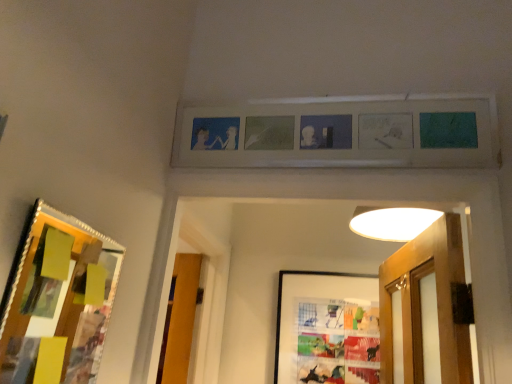
What do you see at coordinates (327, 328) in the screenshot? I see `matte plastic picture frame at center, which ranks as the 1th picture frame in bottom-to-top order` at bounding box center [327, 328].

In order to face wooden-framed collage at left, the 3th picture frame when ordered from back to front, should I rotate leftwards or rightwards?

Rotate your view left by about 23.697°.

Where is `matte plastic picture frame at center, the 1th picture frame when ordered from back to front`? matte plastic picture frame at center, the 1th picture frame when ordered from back to front is located at coordinates (327, 328).

Which is correct: wooden-framed collage at left, the first picture frame when ordered from front to back, is inside matte plastic picture frame at center, the 1th picture frame when ordered from back to front, or outside of it?

wooden-framed collage at left, the first picture frame when ordered from front to back, is not enclosed by matte plastic picture frame at center, the 1th picture frame when ordered from back to front.

What's the angular difference between wooden-framed collage at left, the 3th picture frame when ordered from back to front, and matte plastic picture frame at center, which ranks as the 1th picture frame in bottom-to-top order,'s facing directions?

There is a 88.4-degree angle between the facing directions of wooden-framed collage at left, the 3th picture frame when ordered from back to front, and matte plastic picture frame at center, which ranks as the 1th picture frame in bottom-to-top order.

How distant is wooden-framed collage at left, the first picture frame when ordered from front to back, from matte plastic picture frame at center, the 1th picture frame when ordered from back to front?

wooden-framed collage at left, the first picture frame when ordered from front to back, is 1.14 meters from matte plastic picture frame at center, the 1th picture frame when ordered from back to front.

Does point (98, 351) come farther from viewer compared to point (282, 299)?

No, it is not.

How different are the orientations of wooden-framed collage at left, the 3th picture frame when ordered from back to front, and matte wooden picture frame at upper center, which is counted as the third picture frame, starting from the bottom, in degrees?

89.3 degrees separate the facing orientations of wooden-framed collage at left, the 3th picture frame when ordered from back to front, and matte wooden picture frame at upper center, which is counted as the third picture frame, starting from the bottom.

How much distance is there between wooden-framed collage at left, which is the 2th picture frame from top to bottom, and matte wooden picture frame at upper center, the second picture frame when ordered from front to back?

The distance of wooden-framed collage at left, which is the 2th picture frame from top to bottom, from matte wooden picture frame at upper center, the second picture frame when ordered from front to back, is 26.27 inches.

Is wooden-framed collage at left, the 3th picture frame when ordered from back to front, shorter than matte wooden picture frame at upper center, the first picture frame in the top-to-bottom sequence?

Incorrect, the height of wooden-framed collage at left, the 3th picture frame when ordered from back to front, does not fall short of that of matte wooden picture frame at upper center, the first picture frame in the top-to-bottom sequence.

Is wooden-framed collage at left, which is the 2th picture frame from top to bottom, inside the boundaries of matte wooden picture frame at upper center, which is counted as the third picture frame, starting from the bottom, or outside?

wooden-framed collage at left, which is the 2th picture frame from top to bottom, is outside matte wooden picture frame at upper center, which is counted as the third picture frame, starting from the bottom.

The height and width of the screenshot is (384, 512). I want to click on the 1st picture frame in front of the matte plastic picture frame at center, which is the third picture frame from front to back, counting from the anchor's position, so click(339, 135).

Between matte plastic picture frame at center, which ranks as the 1th picture frame in bottom-to-top order, and matte wooden picture frame at upper center, which is counted as the third picture frame, starting from the bottom, which one has larger size?

With larger size is matte wooden picture frame at upper center, which is counted as the third picture frame, starting from the bottom.

Considering the sizes of matte plastic picture frame at center, which is the third picture frame from front to back, and matte wooden picture frame at upper center, which ranks as the 2th picture frame in back-to-front order, in the image, is matte plastic picture frame at center, which is the third picture frame from front to back, taller or shorter than matte wooden picture frame at upper center, which ranks as the 2th picture frame in back-to-front order,?

Considering their sizes, matte plastic picture frame at center, which is the third picture frame from front to back, has more height than matte wooden picture frame at upper center, which ranks as the 2th picture frame in back-to-front order.

Does matte plastic picture frame at center, which is the third picture frame from front to back, have a lesser width compared to matte wooden picture frame at upper center, which ranks as the 2th picture frame in back-to-front order?

Indeed, matte plastic picture frame at center, which is the third picture frame from front to back, has a lesser width compared to matte wooden picture frame at upper center, which ranks as the 2th picture frame in back-to-front order.

Identify the location of picture frame above the wooden-framed collage at left, the first picture frame when ordered from front to back (from the image's perspective). This screenshot has height=384, width=512. (339, 135).

Looking at their sizes, would you say matte wooden picture frame at upper center, the second picture frame when ordered from front to back, is wider or thinner than wooden-framed collage at left, which is the 2th picture frame from top to bottom?

Clearly, matte wooden picture frame at upper center, the second picture frame when ordered from front to back, has more width compared to wooden-framed collage at left, which is the 2th picture frame from top to bottom.

Is matte wooden picture frame at upper center, the second picture frame when ordered from front to back, not close to wooden-framed collage at left, which is the 2th picture frame from top to bottom?

No, matte wooden picture frame at upper center, the second picture frame when ordered from front to back, is in close proximity to wooden-framed collage at left, which is the 2th picture frame from top to bottom.

Is point (208, 157) farther from viewer compared to point (61, 328)?

No.

Which object is further away from the camera taking this photo, matte plastic picture frame at center, the 1th picture frame when ordered from back to front, or wooden-framed collage at left, the first picture frame when ordered from front to back?

matte plastic picture frame at center, the 1th picture frame when ordered from back to front, is more distant.

Looking at this image, is matte plastic picture frame at center, the 3th picture frame positioned from the top, taller or shorter than wooden-framed collage at left, the 3th picture frame when ordered from back to front?

In the image, matte plastic picture frame at center, the 3th picture frame positioned from the top, appears to be taller than wooden-framed collage at left, the 3th picture frame when ordered from back to front.

Is matte plastic picture frame at center, the 3th picture frame positioned from the top, aimed at wooden-framed collage at left, the 3th picture frame when ordered from back to front?

Yes, matte plastic picture frame at center, the 3th picture frame positioned from the top, is turned towards wooden-framed collage at left, the 3th picture frame when ordered from back to front.

Does matte wooden picture frame at upper center, the second picture frame when ordered from front to back, have a greater width compared to matte plastic picture frame at center, which ranks as the 1th picture frame in bottom-to-top order?

Yes, matte wooden picture frame at upper center, the second picture frame when ordered from front to back, is wider than matte plastic picture frame at center, which ranks as the 1th picture frame in bottom-to-top order.

From a real-world perspective, which is physically below, matte wooden picture frame at upper center, the first picture frame in the top-to-bottom sequence, or matte plastic picture frame at center, the 1th picture frame when ordered from back to front?

matte plastic picture frame at center, the 1th picture frame when ordered from back to front.

From the image's perspective, starting from the matte wooden picture frame at upper center, which is counted as the third picture frame, starting from the bottom, which picture frame is the 2nd one below? Please provide its 2D coordinates.

[(327, 328)]

Considering the positions of objects matte wooden picture frame at upper center, the first picture frame in the top-to-bottom sequence, and matte plastic picture frame at center, which ranks as the 1th picture frame in bottom-to-top order, in the image provided, who is behind, matte wooden picture frame at upper center, the first picture frame in the top-to-bottom sequence, or matte plastic picture frame at center, which ranks as the 1th picture frame in bottom-to-top order,?

matte plastic picture frame at center, which ranks as the 1th picture frame in bottom-to-top order, is behind.

Identify the location of the 2nd picture frame in front of the matte plastic picture frame at center, the 3th picture frame positioned from the top. The image size is (512, 384). (58, 301).

This screenshot has width=512, height=384. I want to click on picture frame that is the 2nd one above the wooden-framed collage at left, which is the second picture frame in bottom-to-top order (from a real-world perspective), so click(339, 135).

Based on their spatial positions, is matte plastic picture frame at center, the 1th picture frame when ordered from back to front, or wooden-framed collage at left, which is the 2th picture frame from top to bottom, further from matte wooden picture frame at upper center, which is counted as the third picture frame, starting from the bottom?

matte plastic picture frame at center, the 1th picture frame when ordered from back to front, is further to matte wooden picture frame at upper center, which is counted as the third picture frame, starting from the bottom.

Estimate the real-world distances between objects in this image. Which object is further from matte wooden picture frame at upper center, the second picture frame when ordered from front to back, wooden-framed collage at left, which is the second picture frame in bottom-to-top order, or matte plastic picture frame at center, the 1th picture frame when ordered from back to front?

matte plastic picture frame at center, the 1th picture frame when ordered from back to front, is further to matte wooden picture frame at upper center, the second picture frame when ordered from front to back.

In the scene shown: Based on their spatial positions, is matte wooden picture frame at upper center, which is counted as the third picture frame, starting from the bottom, or matte plastic picture frame at center, the 1th picture frame when ordered from back to front, further from wooden-framed collage at left, which is the second picture frame in bottom-to-top order?

The object further to wooden-framed collage at left, which is the second picture frame in bottom-to-top order, is matte plastic picture frame at center, the 1th picture frame when ordered from back to front.

Considering their positions, is matte plastic picture frame at center, the 1th picture frame when ordered from back to front, positioned closer to wooden-framed collage at left, the 3th picture frame when ordered from back to front, than matte wooden picture frame at upper center, which is counted as the third picture frame, starting from the bottom?

Based on the image, matte wooden picture frame at upper center, which is counted as the third picture frame, starting from the bottom, appears to be nearer to wooden-framed collage at left, the 3th picture frame when ordered from back to front.

Looking at the image, which one is located closer to matte plastic picture frame at center, which ranks as the 1th picture frame in bottom-to-top order, wooden-framed collage at left, which is the second picture frame in bottom-to-top order, or matte wooden picture frame at upper center, which ranks as the 2th picture frame in back-to-front order?

Among the two, matte wooden picture frame at upper center, which ranks as the 2th picture frame in back-to-front order, is located nearer to matte plastic picture frame at center, which ranks as the 1th picture frame in bottom-to-top order.

Estimate the real-world distances between objects in this image. Which object is further from matte plastic picture frame at center, which is the third picture frame from front to back, matte wooden picture frame at upper center, which ranks as the 2th picture frame in back-to-front order, or wooden-framed collage at left, which is the 2th picture frame from top to bottom?

→ wooden-framed collage at left, which is the 2th picture frame from top to bottom.

This screenshot has height=384, width=512. Identify the location of picture frame located between wooden-framed collage at left, which is the second picture frame in bottom-to-top order, and matte plastic picture frame at center, the 3th picture frame positioned from the top, in the depth direction. (339, 135).